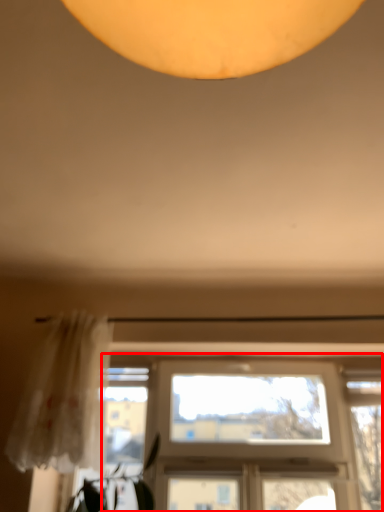
Question: From the image's perspective, what is the correct spatial positioning of window (annotated by the red box) in reference to curtain?

Choices:
 (A) above
 (B) below

Answer: (B)